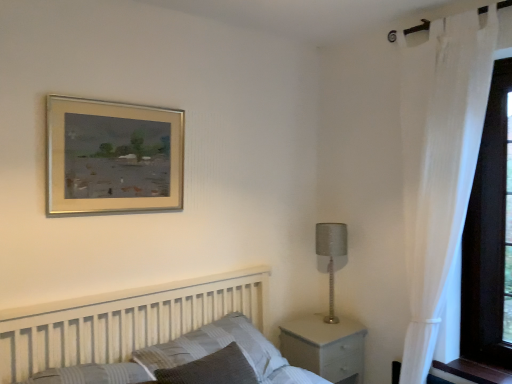
You are a GUI agent. You are given a task and a screenshot of the screen. Output one action in this format:
    pyautogui.click(x=<x>, y=<y>)
    Task: Click on the free space to the left of satin silver lamp at right
    The image size is (512, 384).
    Given the screenshot: What is the action you would take?
    pyautogui.click(x=305, y=327)